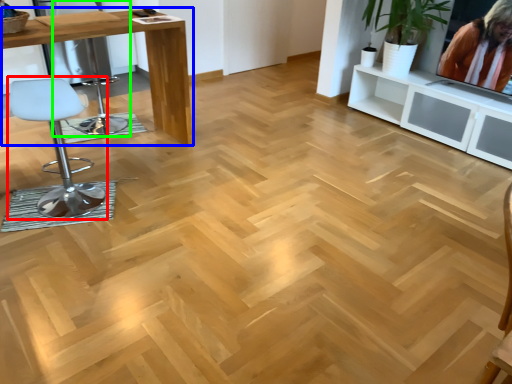
Question: Which object is the closest to the chair (highlighted by a red box)? Choose among these: table (highlighted by a blue box) or swivel chair (highlighted by a green box).

Choices:
 (A) table
 (B) swivel chair

Answer: (A)